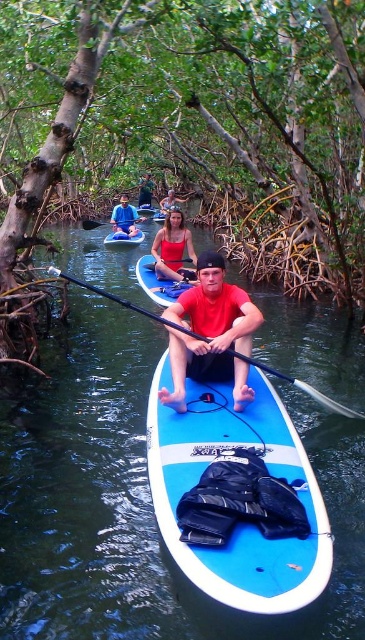
You are a photographer trying to capture the scene of the paddleboarder. You need to position yourself so that the green fabric shirt at upper center and the blue rubber paddle at upper center are both visible in your shot. Based on their positions, which object should appear to the right side of the other in your photo?

The green fabric shirt at upper center is positioned to the right of the blue rubber paddle at upper center, so in the photo, the green fabric shirt at upper center will appear to the right of the blue rubber paddle at upper center.

You are a kayaker who wants to reach the blue rubber paddle at center from the matte red kayak at center. Given that your kayak can only move in straight lines and you need to stay within the narrow waterway, what is the shortest distance you must travel?

The shortest distance you must travel is 15.07 meters, as the matte red kayak at center and blue rubber paddle at center are 15.07 meters apart.

Consider the image. You are a photographer trying to capture the perfect shot of the matte red swimsuit at center and the blue foam paddle at center. Since you want to emphasize their sizes in the photo, which one should you focus on to make sure it appears larger in the frame?

The matte red swimsuit at center has a greater height compared to the blue foam paddle at center, so focusing on the matte red swimsuit at center will make it appear larger in the frame.